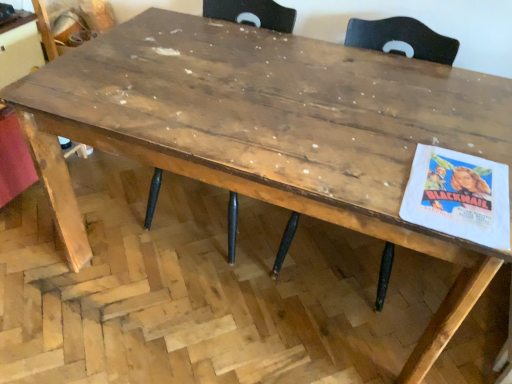
Question: Which direction should I rotate to look at wooden chair at center, marked as the 2th chair in a right-to-left arrangement, — up or down?

Choices:
 (A) up
 (B) down

Answer: (A)

Question: In which direction should I rotate to look at wooden chair at center, which appears as the 2th chair when viewed from the left?

Choices:
 (A) right
 (B) left

Answer: (A)

Question: Is wooden chair at center, which ranks as the 1th chair in left-to-right order, at the back of wooden chair at center, which appears as the 2th chair when viewed from the left?

Choices:
 (A) yes
 (B) no

Answer: (B)

Question: From a real-world perspective, is wooden chair at center, which is the 1th chair from right to left, below wooden chair at center, marked as the 2th chair in a right-to-left arrangement?

Choices:
 (A) yes
 (B) no

Answer: (B)

Question: Could you tell me if wooden chair at center, which is the 1th chair from right to left, is turned towards wooden chair at center, which ranks as the 1th chair in left-to-right order?

Choices:
 (A) yes
 (B) no

Answer: (B)

Question: From a real-world perspective, is wooden chair at center, which is the 1th chair from right to left, on top of wooden chair at center, marked as the 2th chair in a right-to-left arrangement?

Choices:
 (A) no
 (B) yes

Answer: (B)

Question: Is wooden chair at center, which is the 1th chair from right to left, to the right of wooden chair at center, marked as the 2th chair in a right-to-left arrangement, from the viewer's perspective?

Choices:
 (A) no
 (B) yes

Answer: (B)

Question: From the image's perspective, is wooden chair at center, which appears as the 2th chair when viewed from the left, on top of wooden chair at center, which ranks as the 1th chair in left-to-right order?

Choices:
 (A) no
 (B) yes

Answer: (A)

Question: Considering the relative sizes of wooden chair at center, which ranks as the 1th chair in left-to-right order, and wooden chair at center, which appears as the 2th chair when viewed from the left, in the image provided, is wooden chair at center, which ranks as the 1th chair in left-to-right order, thinner than wooden chair at center, which appears as the 2th chair when viewed from the left,?

Choices:
 (A) no
 (B) yes

Answer: (A)

Question: Considering the relative sizes of wooden chair at center, marked as the 2th chair in a right-to-left arrangement, and wooden chair at center, which appears as the 2th chair when viewed from the left, in the image provided, is wooden chair at center, marked as the 2th chair in a right-to-left arrangement, wider than wooden chair at center, which appears as the 2th chair when viewed from the left,?

Choices:
 (A) yes
 (B) no

Answer: (A)

Question: Considering the relative sizes of wooden chair at center, marked as the 2th chair in a right-to-left arrangement, and wooden chair at center, which is the 1th chair from right to left, in the image provided, is wooden chair at center, marked as the 2th chair in a right-to-left arrangement, taller than wooden chair at center, which is the 1th chair from right to left,?

Choices:
 (A) no
 (B) yes

Answer: (B)

Question: Is wooden chair at center, which ranks as the 1th chair in left-to-right order, behind wooden chair at center, which is the 1th chair from right to left?

Choices:
 (A) no
 (B) yes

Answer: (B)

Question: Is wooden chair at center, which ranks as the 1th chair in left-to-right order, in front of wooden chair at center, which is the 1th chair from right to left?

Choices:
 (A) yes
 (B) no

Answer: (B)

Question: From the image's perspective, would you say wooden chair at center, marked as the 2th chair in a right-to-left arrangement, is positioned over wooden chair at center, which appears as the 2th chair when viewed from the left?

Choices:
 (A) no
 (B) yes

Answer: (B)

Question: Considering the positions of wooden chair at center, which is the 1th chair from right to left, and wooden chair at center, marked as the 2th chair in a right-to-left arrangement, in the image, is wooden chair at center, which is the 1th chair from right to left, wider or thinner than wooden chair at center, marked as the 2th chair in a right-to-left arrangement,?

Choices:
 (A) wide
 (B) thin

Answer: (B)